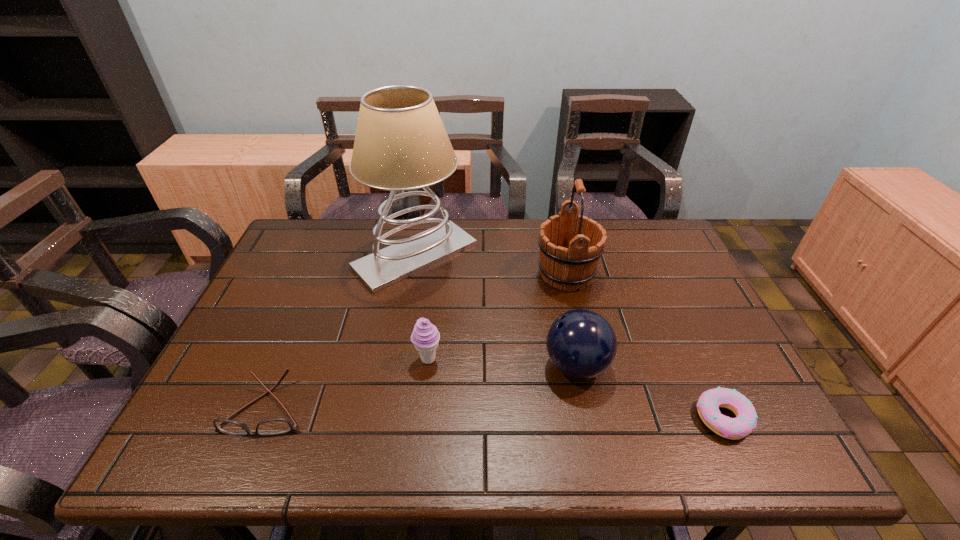
Locate an element on the screen. The image size is (960, 540). vacant space that satisfies the following two spatial constraints: 1. on the surface of the doughnut near the finger holes; 2. on the right side of the bowling ball is located at coordinates [x=587, y=418].

Locate an element on the screen. free location that satisfies the following two spatial constraints: 1. on the front-facing side of the shortest object; 2. on the left side of the spectacles is located at coordinates (262, 418).